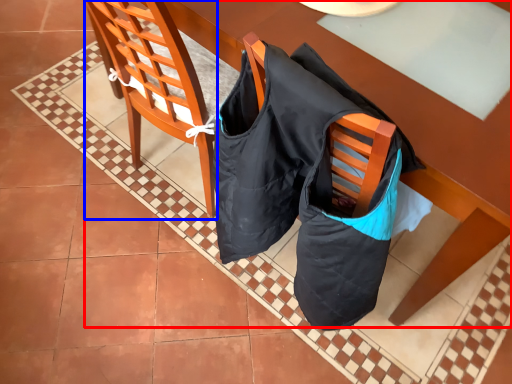
Question: Which point is closer to the camera, table (highlighted by a red box) or chair (highlighted by a blue box)?

Choices:
 (A) table
 (B) chair

Answer: (B)